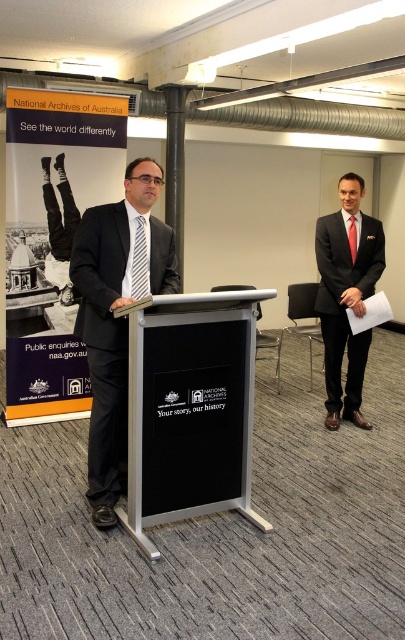
Is matte black poster at left shorter than black plastic pole at upper center?

No, matte black poster at left is not shorter than black plastic pole at upper center.

Does matte black poster at left have a larger size compared to black plastic pole at upper center?

Correct, matte black poster at left is larger in size than black plastic pole at upper center.

Is point (29, 116) behind point (170, 188)?

No, it is in front of (170, 188).

This screenshot has height=640, width=405. What are the coordinates of `matte black poster at left` in the screenshot? It's located at (53, 240).

Can you confirm if matte black poster at left is bigger than black silk tie at center?

Yes, matte black poster at left is bigger than black silk tie at center.

Does matte black poster at left have a lesser width compared to black silk tie at center?

Incorrect, matte black poster at left's width is not less than black silk tie at center's.

Who is more forward, (x=27, y=344) or (x=144, y=262)?

Point (x=144, y=262) is in front.

The image size is (405, 640). Identify the location of matte black poster at left. (53, 240).

Which is behind, point (181, 157) or point (353, 221)?

Point (181, 157)

Where is `black plastic pole at upper center`? This screenshot has height=640, width=405. black plastic pole at upper center is located at coordinates (174, 164).

Does point (176, 253) come in front of point (349, 248)?

Yes, point (176, 253) is closer to viewer.

At what (x,y) coordinates should I click in order to perform the action: click on black plastic pole at upper center. Please return your answer as a coordinate pair (x, y). The height and width of the screenshot is (640, 405). Looking at the image, I should click on (174, 164).